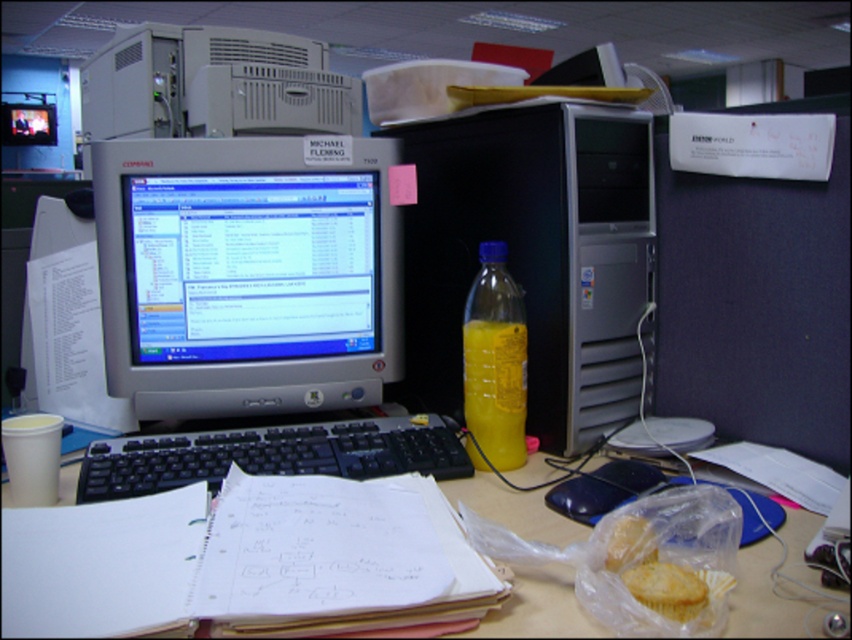
You are organizing the desk and need to move items closer to you. Which object should you move first to make space, the silver plastic monitor at center or the satin silver computer tower at center?

You should move the silver plastic monitor at center first because it is closer to you than the satin silver computer tower at center, so moving it would free up space more effectively.

You are setting up a new desk and want to place a mouse between the satin silver computer tower at center and the black plastic keyboard at center. The mouse requires 8 inches of space. Is there enough space between them to fit the mouse?

The satin silver computer tower at center is 12.60 inches from the black plastic keyboard at center, so yes, the mouse can fit between them since the distance is greater than the required 8 inches.

You are organizing a desk and need to know the dimensions of the silver plastic monitor at center and the translucent plastic table at center. Which object is narrower?

The silver plastic monitor at center is narrower than the translucent plastic table at center.